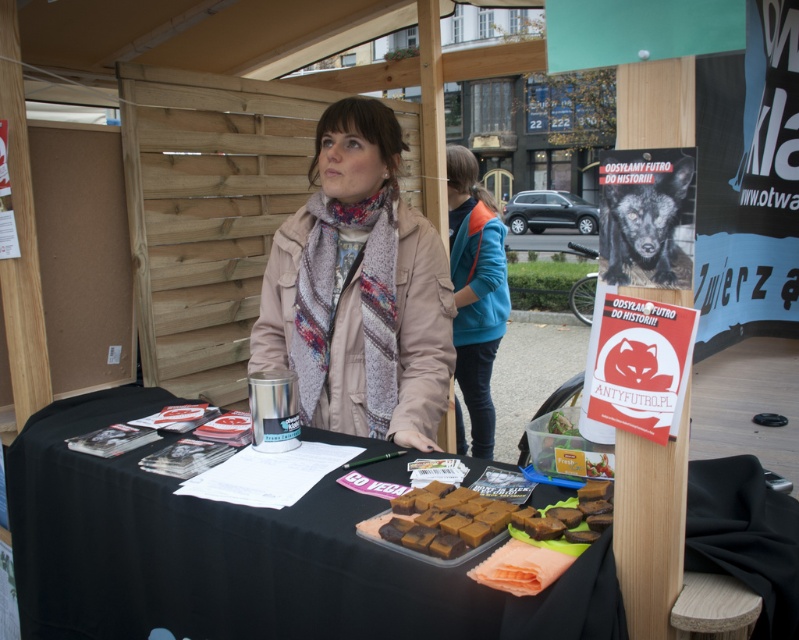
Is the position of black fabric table at center less distant than that of brown matte fudge at lower center?

Yes.

Between point (177, 611) and point (553, 536), which one is positioned behind?

Point (177, 611)

The image size is (799, 640). What are the coordinates of `black fabric table at center` in the screenshot? It's located at (241, 556).

Which is above, blue fabric jacket at center or brown matte fudge at center?

Positioned higher is blue fabric jacket at center.

Is point (454, 259) less distant than point (489, 529)?

No, (454, 259) is further to viewer.

You are a GUI agent. You are given a task and a screenshot of the screen. Output one action in this format:
    pyautogui.click(x=<x>, y=<y>)
    Task: Click on the blue fabric jacket at center
    The image size is (799, 640).
    Given the screenshot: What is the action you would take?
    pyautogui.click(x=475, y=291)

Between black fabric table at center and beige fabric coat at center, which one is positioned higher?

Result: Positioned higher is beige fabric coat at center.

Which of these two, black fabric table at center or beige fabric coat at center, stands taller?

beige fabric coat at center

Between point (221, 531) and point (320, 224), which one is positioned in front?

Point (221, 531) is more forward.

Where is `black fabric table at center`? The height and width of the screenshot is (640, 799). black fabric table at center is located at coordinates (241, 556).